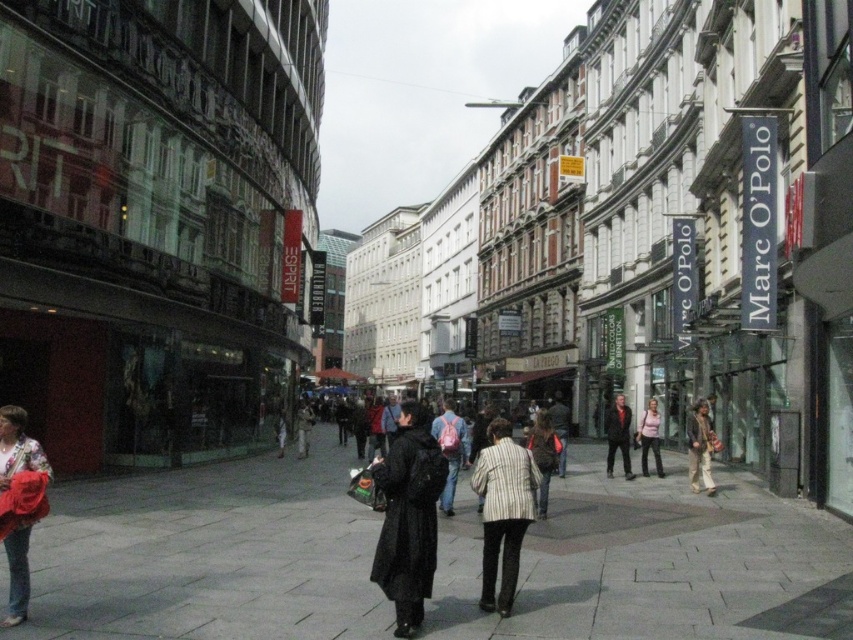
Is point (22, 573) closer to camera compared to point (531, 435)?

Yes, point (22, 573) is closer to viewer.

Who is lower down, red fabric coat at lower left or striped fabric coat at center?

striped fabric coat at center is lower down.

Is point (16, 577) less distant than point (541, 500)?

Yes, point (16, 577) is closer to viewer.

Where is `red fabric coat at lower left`? The width and height of the screenshot is (853, 640). red fabric coat at lower left is located at coordinates (19, 502).

This screenshot has height=640, width=853. What do you see at coordinates (19, 502) in the screenshot? I see `red fabric coat at lower left` at bounding box center [19, 502].

Describe the element at coordinates (19, 502) in the screenshot. The width and height of the screenshot is (853, 640). I see `red fabric coat at lower left` at that location.

Identify the location of red fabric coat at lower left. This screenshot has width=853, height=640. (19, 502).

How much distance is there between black matte coat at center and matte pink backpack at center?

4.08 meters

Is black matte coat at center smaller than matte pink backpack at center?

Yes, black matte coat at center is smaller than matte pink backpack at center.

Is point (425, 420) positioned behind point (456, 426)?

Yes, it is.

You are a GUI agent. You are given a task and a screenshot of the screen. Output one action in this format:
    pyautogui.click(x=<x>, y=<y>)
    Task: Click on the black matte coat at center
    
    Given the screenshot: What is the action you would take?
    pyautogui.click(x=408, y=516)